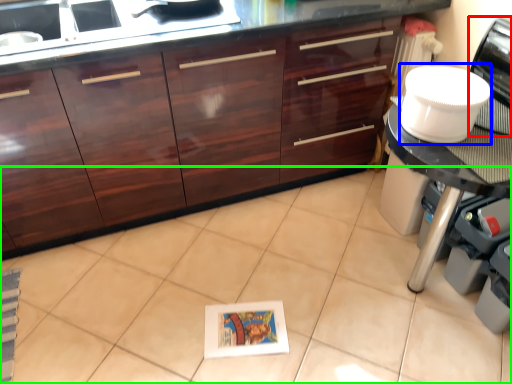
Question: Which is nearer to the home appliance (highlighted by a red box)? appliance (highlighted by a blue box) or ceramic tile (highlighted by a green box).

Choices:
 (A) appliance
 (B) ceramic tile

Answer: (A)